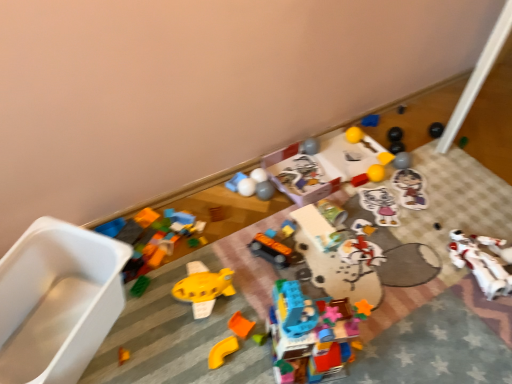
Question: From the image's perspective, would you say yellow rubber ball at upper center, which appears as the 6th toy when viewed from the right, is shown under translucent plastic building blocks at center, the 9th toy positioned from the left?

Choices:
 (A) yes
 (B) no

Answer: (B)

Question: Is yellow rubber ball at upper center, the twelfth toy viewed from the left, facing away from translucent plastic building blocks at center, the 9th toy positioned from the left?

Choices:
 (A) no
 (B) yes

Answer: (A)

Question: Is yellow rubber ball at upper center, the twelfth toy viewed from the left, smaller than translucent plastic building blocks at center, which ranks as the ninth toy in right-to-left order?

Choices:
 (A) no
 (B) yes

Answer: (B)

Question: Could you tell me if yellow rubber ball at upper center, which appears as the 6th toy when viewed from the right, is facing translucent plastic building blocks at center, the 9th toy positioned from the left?

Choices:
 (A) no
 (B) yes

Answer: (A)

Question: Considering the relative positions of yellow rubber ball at upper center, the twelfth toy viewed from the left, and translucent plastic building blocks at center, which ranks as the ninth toy in right-to-left order, in the image provided, is yellow rubber ball at upper center, the twelfth toy viewed from the left, to the right of translucent plastic building blocks at center, which ranks as the ninth toy in right-to-left order, from the viewer's perspective?

Choices:
 (A) no
 (B) yes

Answer: (B)

Question: From a real-world perspective, is orange matte block at center, which is the thirteenth toy from right to left, physically located above or below metallic silver can at center, the eleventh toy positioned from the left?

Choices:
 (A) below
 (B) above

Answer: (A)

Question: Is orange matte block at center, which is the thirteenth toy from right to left, wider or thinner than metallic silver can at center, the eleventh toy positioned from the left?

Choices:
 (A) thin
 (B) wide

Answer: (A)

Question: Based on their positions, is orange matte block at center, which ranks as the fifth toy in left-to-right order, located to the left or right of metallic silver can at center, the eleventh toy positioned from the left?

Choices:
 (A) left
 (B) right

Answer: (A)

Question: From the image's perspective, relative to metallic silver can at center, the eleventh toy positioned from the left, is orange matte block at center, which ranks as the fifth toy in left-to-right order, above or below?

Choices:
 (A) above
 (B) below

Answer: (B)

Question: Relative to metallic silver can at center, arranged as the 7th toy when viewed from the right, is matte plastic blocks at upper center, the fourteenth toy in the right-to-left sequence, in front or behind?

Choices:
 (A) front
 (B) behind

Answer: (B)

Question: Would you say matte plastic blocks at upper center, the fourteenth toy in the right-to-left sequence, is to the left or to the right of metallic silver can at center, the eleventh toy positioned from the left, in the picture?

Choices:
 (A) left
 (B) right

Answer: (A)

Question: From a real-world perspective, is matte plastic blocks at upper center, the fourteenth toy in the right-to-left sequence, positioned above or below metallic silver can at center, the eleventh toy positioned from the left?

Choices:
 (A) below
 (B) above

Answer: (A)

Question: From their relative heights in the image, would you say matte plastic blocks at upper center, the fourteenth toy in the right-to-left sequence, is taller or shorter than metallic silver can at center, the eleventh toy positioned from the left?

Choices:
 (A) short
 (B) tall

Answer: (A)

Question: Looking at the image, does orange matte plastic toy at lower center, the third toy when ordered from left to right, seem bigger or smaller compared to orange matte block at center, which is the thirteenth toy from right to left?

Choices:
 (A) big
 (B) small

Answer: (A)

Question: In terms of height, does orange matte plastic toy at lower center, the third toy when ordered from left to right, look taller or shorter compared to orange matte block at center, which ranks as the fifth toy in left-to-right order?

Choices:
 (A) short
 (B) tall

Answer: (B)